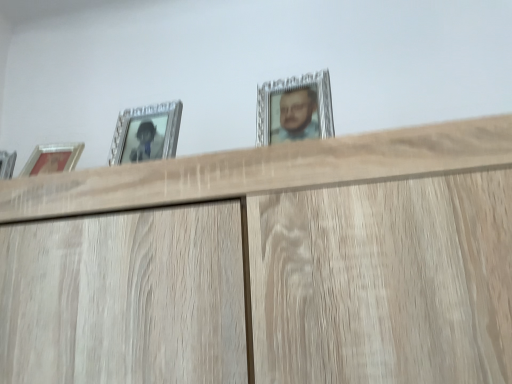
Question: Is silver metallic picture frame at upper center, which ranks as the 2th picture frame in left-to-right order, bigger than silver metallic picture frame at upper left, which is counted as the 2th picture frame, starting from the right?

Choices:
 (A) yes
 (B) no

Answer: (A)

Question: Is silver metallic picture frame at upper center, which is the first picture frame in right-to-left order, aimed at silver metallic picture frame at upper left, which is the 1th picture frame from left to right?

Choices:
 (A) yes
 (B) no

Answer: (B)

Question: From a real-world perspective, is silver metallic picture frame at upper center, which ranks as the 2th picture frame in left-to-right order, positioned under silver metallic picture frame at upper left, which is counted as the 2th picture frame, starting from the right, based on gravity?

Choices:
 (A) no
 (B) yes

Answer: (A)

Question: Can you confirm if silver metallic picture frame at upper center, which ranks as the 2th picture frame in left-to-right order, is smaller than silver metallic picture frame at upper left, which is the 1th picture frame from left to right?

Choices:
 (A) yes
 (B) no

Answer: (B)

Question: Is silver metallic picture frame at upper center, which is the first picture frame in right-to-left order, oriented away from silver metallic picture frame at upper left, which is the 1th picture frame from left to right?

Choices:
 (A) yes
 (B) no

Answer: (B)

Question: Can you confirm if silver metallic picture frame at upper center, which is the first picture frame in right-to-left order, is positioned to the left of silver metallic picture frame at upper left, which is counted as the 2th picture frame, starting from the right?

Choices:
 (A) no
 (B) yes

Answer: (A)

Question: Is silver metallic picture frame at upper left, which is counted as the 2th picture frame, starting from the right, facing towards silver metallic picture frame at upper center, which ranks as the 2th picture frame in left-to-right order?

Choices:
 (A) no
 (B) yes

Answer: (A)

Question: From the image's perspective, is silver metallic picture frame at upper left, which is counted as the 2th picture frame, starting from the right, located beneath silver metallic picture frame at upper center, which ranks as the 2th picture frame in left-to-right order?

Choices:
 (A) yes
 (B) no

Answer: (A)

Question: Does silver metallic picture frame at upper left, which is the 1th picture frame from left to right, lie behind silver metallic picture frame at upper center, which is the first picture frame in right-to-left order?

Choices:
 (A) yes
 (B) no

Answer: (A)

Question: Does silver metallic picture frame at upper left, which is counted as the 2th picture frame, starting from the right, have a greater height compared to silver metallic picture frame at upper center, which ranks as the 2th picture frame in left-to-right order?

Choices:
 (A) no
 (B) yes

Answer: (B)

Question: Is silver metallic picture frame at upper left, which is the 1th picture frame from left to right, not inside silver metallic picture frame at upper center, which ranks as the 2th picture frame in left-to-right order?

Choices:
 (A) yes
 (B) no

Answer: (A)

Question: From a real-world perspective, is silver metallic picture frame at upper left, which is counted as the 2th picture frame, starting from the right, physically below silver metallic picture frame at upper center, which is the first picture frame in right-to-left order?

Choices:
 (A) no
 (B) yes

Answer: (B)

Question: Considering the positions of silver metallic picture frame at upper left, which is the 1th picture frame from left to right, and silver metallic picture frame at upper center, which ranks as the 2th picture frame in left-to-right order, in the image, is silver metallic picture frame at upper left, which is the 1th picture frame from left to right, bigger or smaller than silver metallic picture frame at upper center, which ranks as the 2th picture frame in left-to-right order,?

Choices:
 (A) small
 (B) big

Answer: (A)